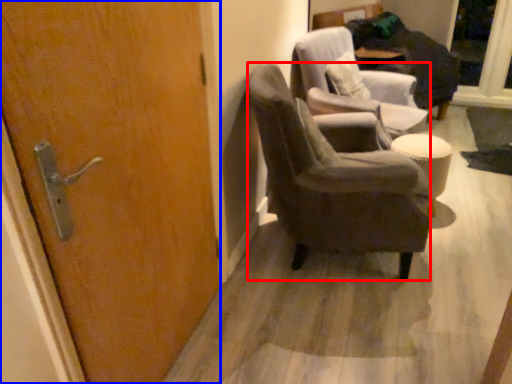
Question: Which of the following is the farthest to the observer, chair (highlighted by a red box) or door (highlighted by a blue box)?

Choices:
 (A) chair
 (B) door

Answer: (A)